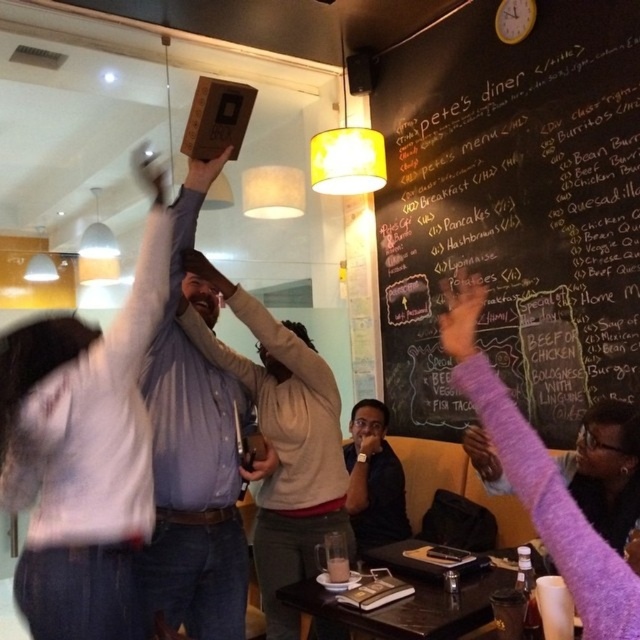
Based on the photo, can you confirm if matte blue shirt at center is positioned to the right of purple fuzzy arm at upper right?

No, matte blue shirt at center is not to the right of purple fuzzy arm at upper right.

Does matte blue shirt at center appear under purple fuzzy arm at upper right?

Indeed, matte blue shirt at center is positioned under purple fuzzy arm at upper right.

Does point (296, 561) come behind point (516, 467)?

Yes, it is.

You are a GUI agent. You are given a task and a screenshot of the screen. Output one action in this format:
    pyautogui.click(x=<x>, y=<y>)
    Task: Click on the matte blue shirt at center
    
    Given the screenshot: What is the action you would take?
    pyautogui.click(x=282, y=440)

Who is more distant from viewer, (627, 342) or (552, 506)?

The point (627, 342) is behind.

Between black chalkboard menu at upper right and purple fuzzy arm at upper right, which one appears on the left side from the viewer's perspective?

From the viewer's perspective, purple fuzzy arm at upper right appears more on the left side.

Which is in front, point (548, 161) or point (451, 330)?

Point (451, 330) is in front.

Where is `black chalkboard menu at upper right`? The image size is (640, 640). black chalkboard menu at upper right is located at coordinates coord(513,209).

The height and width of the screenshot is (640, 640). Find the location of `purple fuzzy arm at upper right`. purple fuzzy arm at upper right is located at coordinates pos(540,480).

This screenshot has width=640, height=640. Describe the element at coordinates (540, 480) in the screenshot. I see `purple fuzzy arm at upper right` at that location.

Find the location of a particular element. The height and width of the screenshot is (640, 640). purple fuzzy arm at upper right is located at coordinates (540, 480).